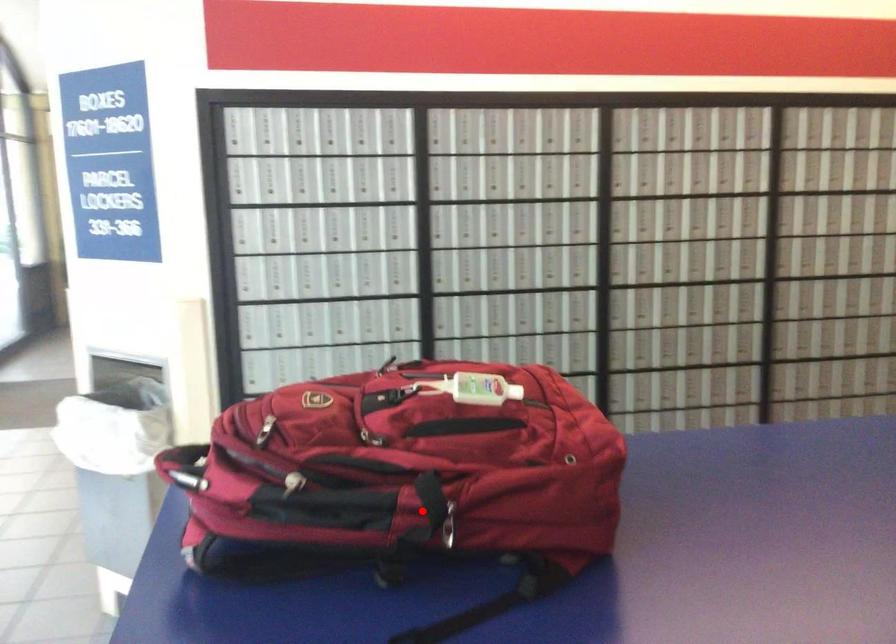
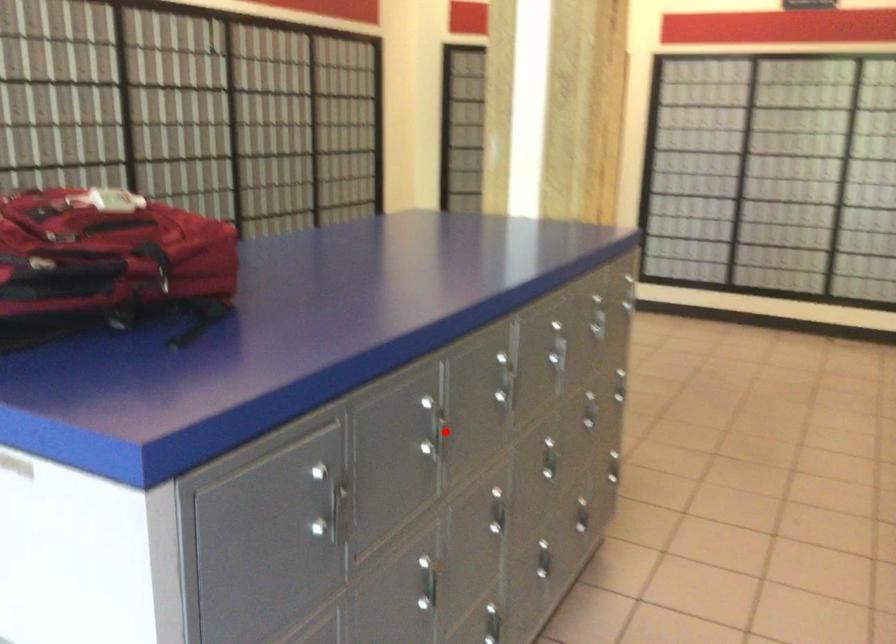
I am providing you with two images of the same scene from different viewpoints. A red point is marked on the first image and another point is marked on the second image. Is the red point in image1 aligned with the point shown in image2?

No